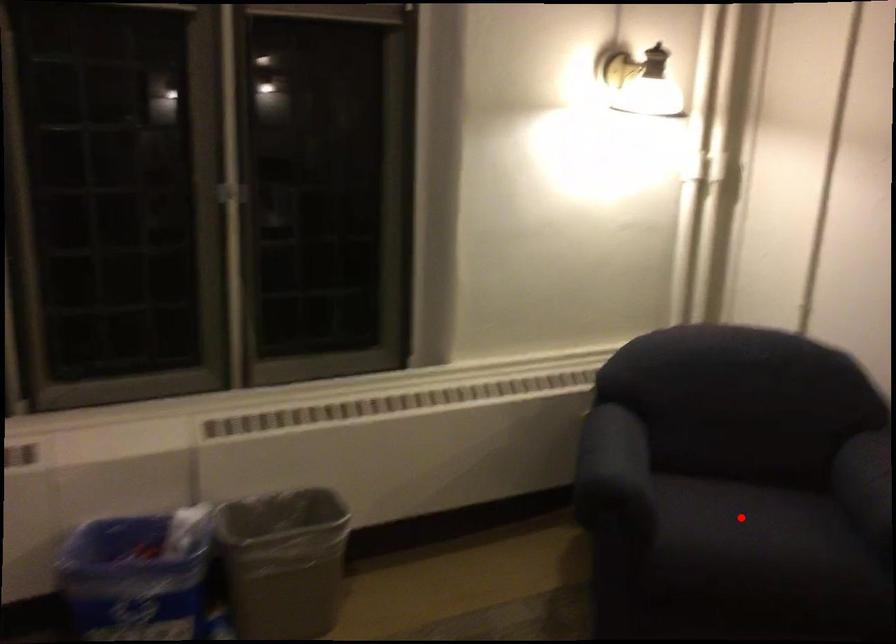
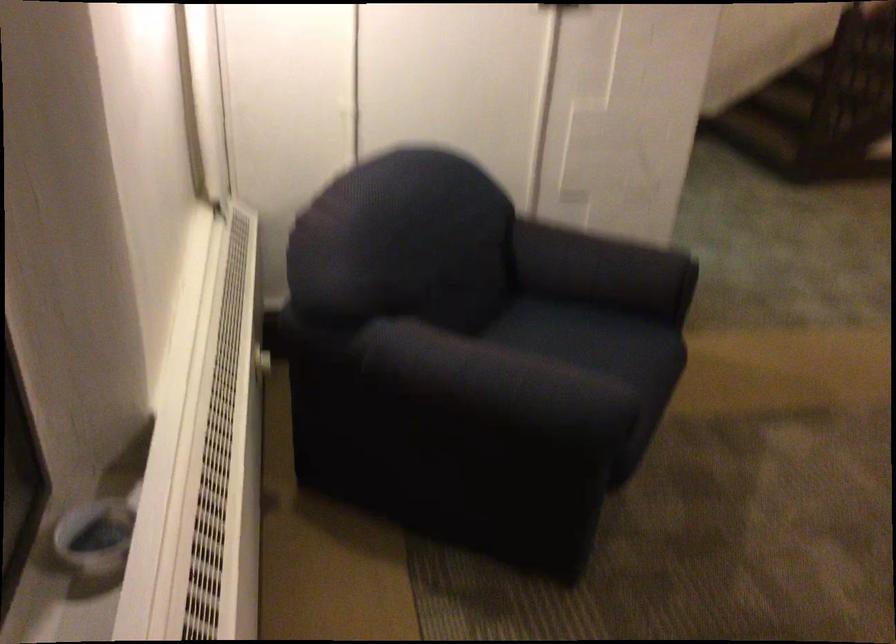
In the second image, find the point that corresponds to the highlighted location in the first image.

(601, 355)